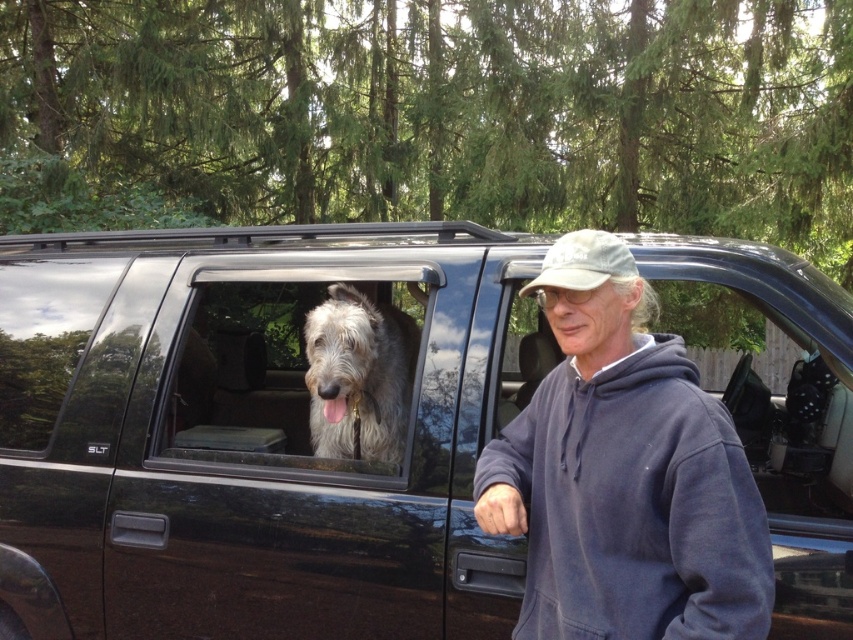
You are a fashion designer observing the scene. You notice the navy blue hoodie at center and the camouflage fabric baseball cap at center. How far apart are these two items in inches?

The navy blue hoodie at center is 13.32 inches away from the camouflage fabric baseball cap at center.

Looking at this image, you are a delivery person trying to place a package on the roof of the SUV. The package requires a flat area at least 0.5 meters wide. Can you confirm if the roof of the SUV at point (259, 429) has enough space?

The glossy black SUV at center has a roof that is flat and wide enough to accommodate the package since the point (259, 429) indicates the center of the vehicle where the roof is typically spacious enough for such a package.